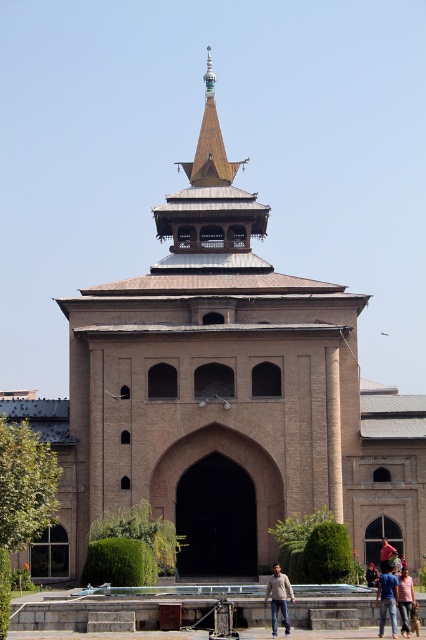
Question: Among these objects, which one is farthest from the camera?

Choices:
 (A) light brown leather jacket at lower center
 (B) blue denim jeans at center

Answer: (B)

Question: Is shiny copper spire at upper center closer to camera compared to pink fabric at center?

Choices:
 (A) no
 (B) yes

Answer: (A)

Question: Which point is farther from the camera taking this photo?

Choices:
 (A) (222, 184)
 (B) (213, 189)
 (C) (382, 621)
 (D) (273, 630)

Answer: (A)

Question: Can you confirm if blue cotton shirt at lower center is positioned below blue denim jeans at center?

Choices:
 (A) no
 (B) yes

Answer: (A)

Question: Which object appears closest to the camera in this image?

Choices:
 (A) blue denim jeans at center
 (B) blue cotton shirt at lower center
 (C) shiny copper spire at upper center
 (D) light blue denim jeans at lower center

Answer: (B)

Question: Can you confirm if wooden spire at upper center is positioned to the right of pink fabric at center?

Choices:
 (A) no
 (B) yes

Answer: (A)